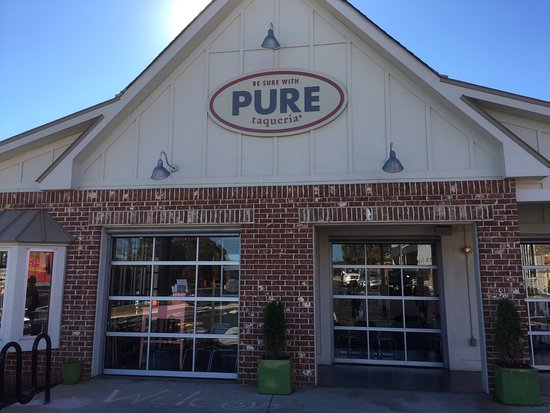
You are a GUI agent. You are given a task and a screenshot of the screen. Output one action in this format:
    pyautogui.click(x=<x>, y=<y>)
    Task: Click on the potted plant
    The width and height of the screenshot is (550, 413).
    Given the screenshot: What is the action you would take?
    271,382, 525,391